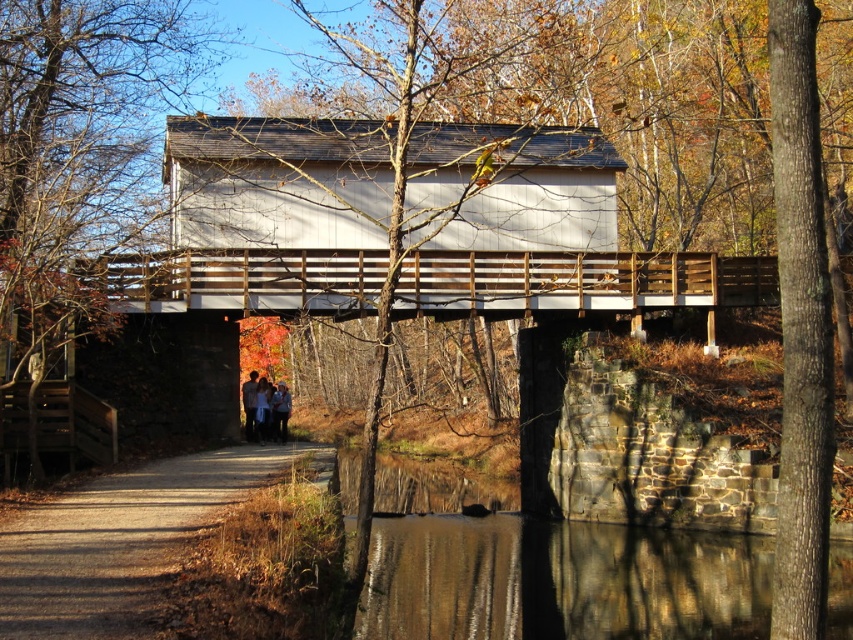
Does light blue denim jacket at center appear under matte gray jacket at center?

Yes.

Who is positioned more to the left, light blue denim jacket at center or matte gray jacket at center?

matte gray jacket at center is more to the left.

Describe the element at coordinates (280, 412) in the screenshot. I see `light blue denim jacket at center` at that location.

At what (x,y) coordinates should I click in order to perform the action: click on light blue denim jacket at center. Please return your answer as a coordinate pair (x, y). The width and height of the screenshot is (853, 640). Looking at the image, I should click on [280, 412].

Is point (260, 428) in front of point (253, 410)?

No.

Is white cotton shirt at center in front of matte gray jacket at center?

No, white cotton shirt at center is further to the viewer.

Is point (258, 413) positioned in front of point (254, 381)?

That is True.

The width and height of the screenshot is (853, 640). What are the coordinates of `white cotton shirt at center` in the screenshot? It's located at [x=262, y=408].

Can you confirm if smooth stone wall at lower center is positioned above matte gray jacket at center?

Actually, smooth stone wall at lower center is below matte gray jacket at center.

Who is taller, smooth stone wall at lower center or matte gray jacket at center?

smooth stone wall at lower center is taller.

Find the location of a particular element. The image size is (853, 640). smooth stone wall at lower center is located at coordinates (544, 570).